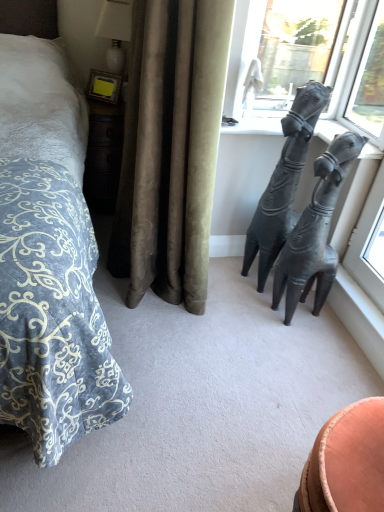
Question: Can you confirm if transparent glass window at upper right, placed as the second window when sorted from left to right, is smaller than white glossy lamp at upper left?

Choices:
 (A) yes
 (B) no

Answer: (A)

Question: Is transparent glass window at upper right, placed as the second window when sorted from left to right, in front of white glossy lamp at upper left?

Choices:
 (A) no
 (B) yes

Answer: (B)

Question: Can you confirm if transparent glass window at upper right, placed as the second window when sorted from left to right, is taller than white glossy lamp at upper left?

Choices:
 (A) no
 (B) yes

Answer: (B)

Question: Is transparent glass window at upper right, the 1th window from the right, looking in the opposite direction of white glossy lamp at upper left?

Choices:
 (A) no
 (B) yes

Answer: (A)

Question: From the image's perspective, is transparent glass window at upper right, placed as the second window when sorted from left to right, on white glossy lamp at upper left?

Choices:
 (A) yes
 (B) no

Answer: (B)

Question: From their relative heights in the image, would you say black matte sculpture at right, which is counted as the first statue (sculpture), starting from the left, is taller or shorter than black matte hand sculpture at upper right, which is the 1th statue (sculpture) from right to left?

Choices:
 (A) tall
 (B) short

Answer: (A)

Question: Do you think black matte sculpture at right, which is the 2th statue (sculpture) from right to left, is within black matte hand sculpture at upper right, which is the 1th statue (sculpture) from right to left, or outside of it?

Choices:
 (A) outside
 (B) inside

Answer: (A)

Question: Is black matte sculpture at right, which is the 2th statue (sculpture) from right to left, to the left or to the right of black matte hand sculpture at upper right, which is the 1th statue (sculpture) from right to left, in the image?

Choices:
 (A) left
 (B) right

Answer: (A)

Question: Relative to black matte hand sculpture at upper right, the second statue (sculpture) positioned from the left, is black matte sculpture at right, which is counted as the first statue (sculpture), starting from the left, in front or behind?

Choices:
 (A) front
 (B) behind

Answer: (B)

Question: Considering the positions of point (168, 71) and point (271, 218), is point (168, 71) closer or farther from the camera than point (271, 218)?

Choices:
 (A) farther
 (B) closer

Answer: (B)

Question: From the image's perspective, is satin beige curtain at center above or below black matte sculpture at right, which is counted as the first statue (sculpture), starting from the left?

Choices:
 (A) above
 (B) below

Answer: (A)

Question: Choose the correct answer: Is satin beige curtain at center inside black matte sculpture at right, which is counted as the first statue (sculpture), starting from the left, or outside it?

Choices:
 (A) inside
 (B) outside

Answer: (B)

Question: Considering the relative positions of satin beige curtain at center and black matte sculpture at right, which is counted as the first statue (sculpture), starting from the left, in the image provided, is satin beige curtain at center to the left or to the right of black matte sculpture at right, which is counted as the first statue (sculpture), starting from the left,?

Choices:
 (A) right
 (B) left

Answer: (B)

Question: Considering their positions, is black matte hand sculpture at upper right, which is the 1th statue (sculpture) from right to left, located in front of or behind black matte sculpture at right, which is counted as the first statue (sculpture), starting from the left?

Choices:
 (A) behind
 (B) front

Answer: (B)

Question: Do you think black matte hand sculpture at upper right, the second statue (sculpture) positioned from the left, is within black matte sculpture at right, which is counted as the first statue (sculpture), starting from the left, or outside of it?

Choices:
 (A) outside
 (B) inside

Answer: (A)